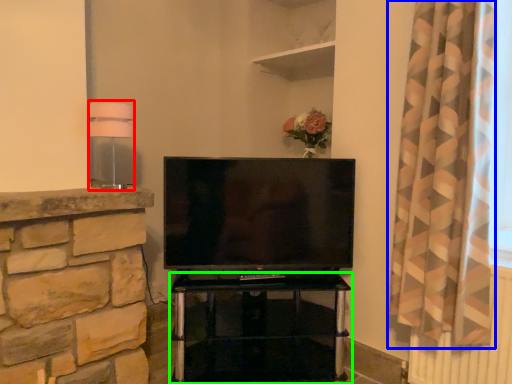
Question: Which object is positioned farthest from lamp (highlighted by a red box)? Select from curtain (highlighted by a blue box) and furniture (highlighted by a green box).

Choices:
 (A) curtain
 (B) furniture

Answer: (B)